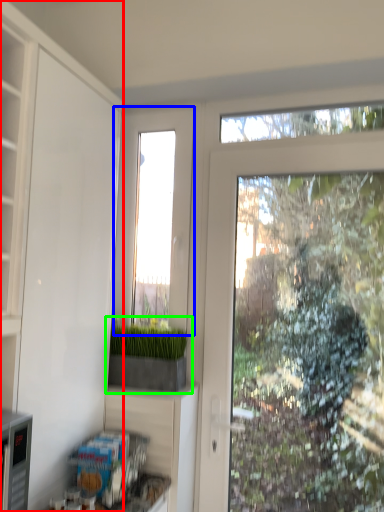
Question: Which object is the farthest from cabinetry (highlighted by a red box)? Choose among these: window (highlighted by a blue box) or houseplant (highlighted by a green box).

Choices:
 (A) window
 (B) houseplant

Answer: (A)